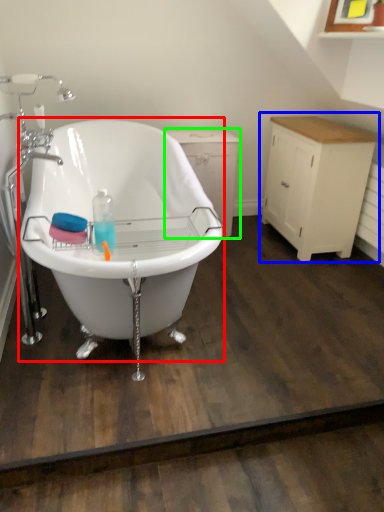
Question: Which object is the closest to the bathtub (highlighted by a red box)? Choose among these: cabinetry (highlighted by a blue box) or dresser (highlighted by a green box).

Choices:
 (A) cabinetry
 (B) dresser

Answer: (B)